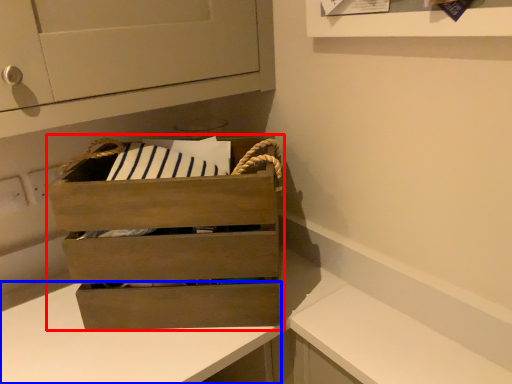
Question: Which object is further to the camera taking this photo, chest of drawers (highlighted by a red box) or counter (highlighted by a blue box)?

Choices:
 (A) chest of drawers
 (B) counter

Answer: (A)